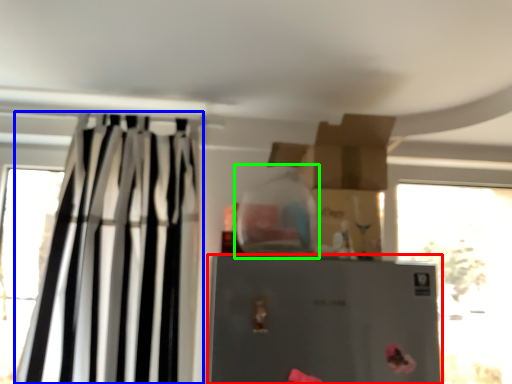
Question: Based on their relative distances, which object is nearer to refrigerator (highlighted by a red box)? Choose from curtain (highlighted by a blue box) and bottle (highlighted by a green box).

Choices:
 (A) curtain
 (B) bottle

Answer: (B)